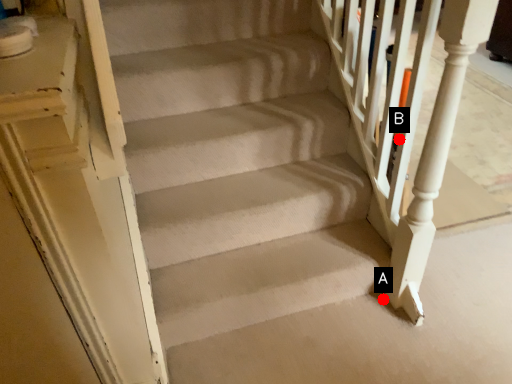
Question: Two points are circled on the image, labeled by A and B beside each circle. Which of the following is the closest to the observer?

Choices:
 (A) A is closer
 (B) B is closer

Answer: (B)